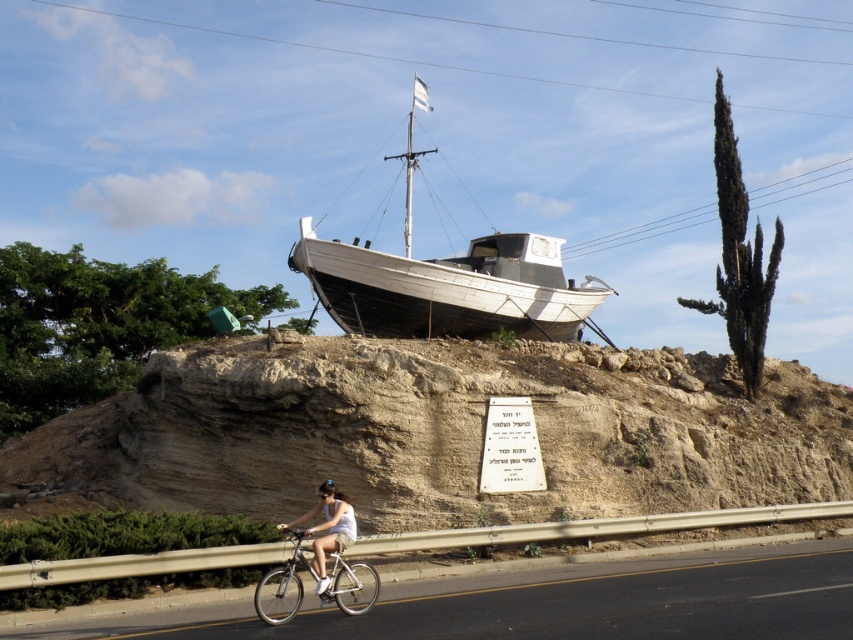
Question: Considering the real-world distances, which object is farthest from the black asphalt road at lower center?

Choices:
 (A) white cotton dress at lower center
 (B) brown sandy hillside at center
 (C) white matte boat at center
 (D) silver metallic bicycle at lower center

Answer: (C)

Question: Is white matte boat at center below silver metallic bicycle at lower center?

Choices:
 (A) yes
 (B) no

Answer: (B)

Question: Does black asphalt road at lower center have a smaller size compared to white cotton dress at lower center?

Choices:
 (A) yes
 (B) no

Answer: (B)

Question: Does black asphalt road at lower center appear over white cotton dress at lower center?

Choices:
 (A) no
 (B) yes

Answer: (A)

Question: Which point appears farthest from the camera in this image?

Choices:
 (A) (323, 561)
 (B) (370, 289)
 (C) (386, 378)

Answer: (B)

Question: Which point appears farthest from the camera in this image?

Choices:
 (A) (468, 369)
 (B) (819, 593)
 (C) (486, 291)

Answer: (C)